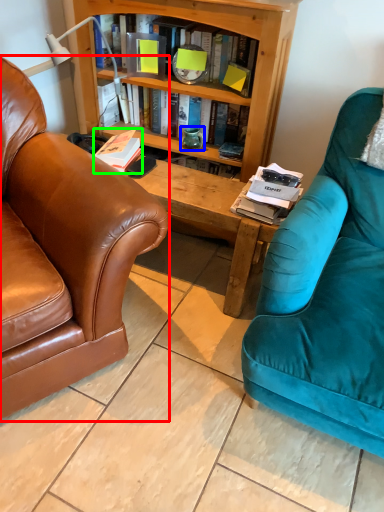
Question: Based on their relative distances, which object is nearer to chair (highlighted by a red box)? Choose from teal (highlighted by a blue box) and book (highlighted by a green box).

Choices:
 (A) teal
 (B) book

Answer: (B)